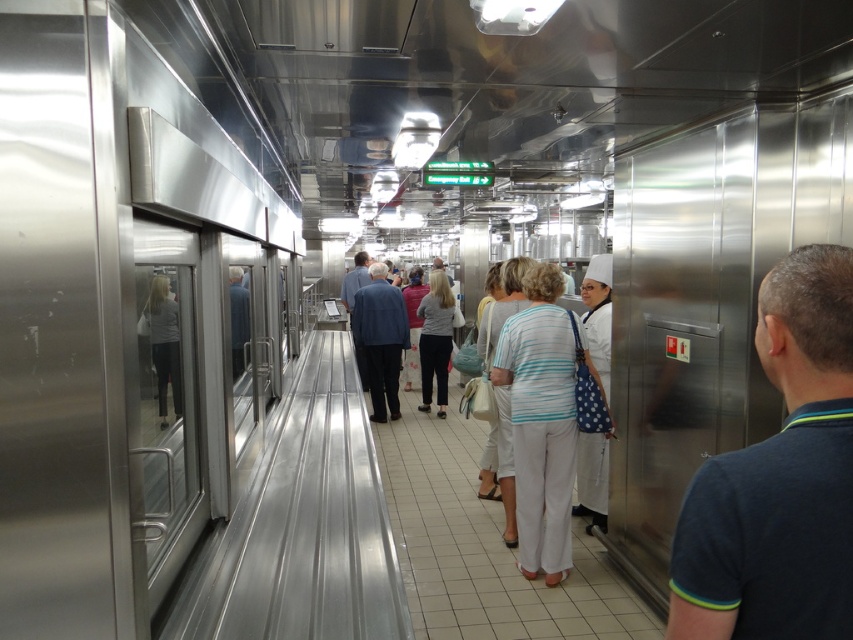
Question: Among these objects, which one is farthest from the camera?

Choices:
 (A) dark blue shirt at right
 (B) blue fabric jacket at center

Answer: (B)

Question: Considering the relative positions of white fabric dress at center and white dotted apron at center in the image provided, where is white fabric dress at center located with respect to white dotted apron at center?

Choices:
 (A) below
 (B) above

Answer: (A)

Question: Does blue fabric jacket at center appear under light gray fabric jacket at center?

Choices:
 (A) no
 (B) yes

Answer: (B)

Question: Which point is farther from the camera taking this photo?

Choices:
 (A) (419, 355)
 (B) (165, 304)

Answer: (A)

Question: Which of the following is the farthest from the observer?

Choices:
 (A) (592, 509)
 (B) (564, 497)
 (C) (177, 321)

Answer: (A)

Question: Is white chef hat at center smaller than light gray fabric jacket at center?

Choices:
 (A) no
 (B) yes

Answer: (A)